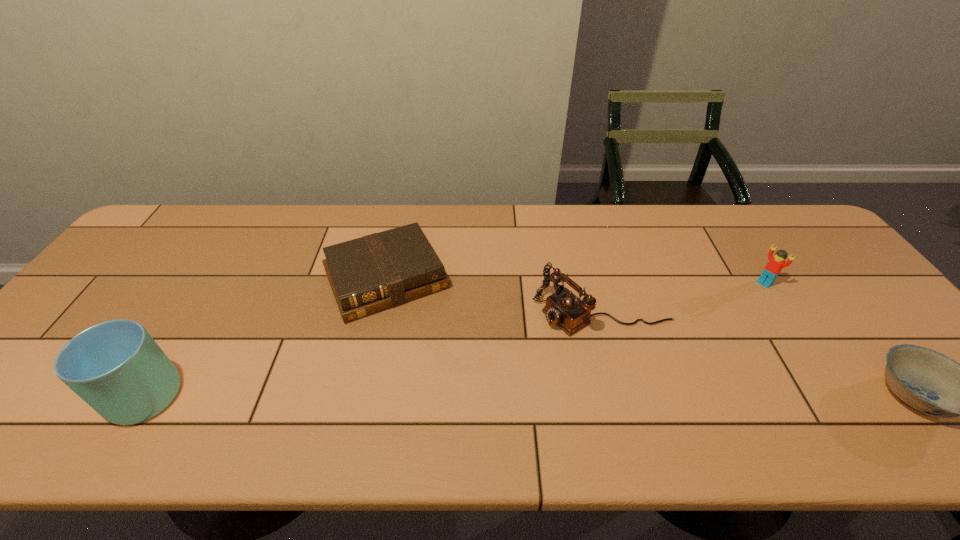
The width and height of the screenshot is (960, 540). Identify the location of free location at the right edge of the desktop. (818, 299).

In order to click on free space at the far left corner in this screenshot , I will do `click(184, 236)`.

You are a GUI agent. You are given a task and a screenshot of the screen. Output one action in this format:
    pyautogui.click(x=<x>, y=<y>)
    Task: Click on the unoccupied position between the Lego and the third object from left to right
    
    Given the screenshot: What is the action you would take?
    [683, 297]

This screenshot has width=960, height=540. I want to click on free space between the third object from left to right and the fourth object from left to right, so (683, 297).

Locate an element on the screen. unoccupied position between the third object from right to left and the tallest object is located at coordinates (369, 354).

The height and width of the screenshot is (540, 960). Identify the location of free space between the second object from left to right and the third object from right to left. (493, 295).

Locate an element on the screen. Image resolution: width=960 pixels, height=540 pixels. free space that is in between the tallest object and the second object from right to left is located at coordinates (450, 339).

The height and width of the screenshot is (540, 960). I want to click on free point between the tallest object and the second object from left to right, so click(x=261, y=338).

Locate an element on the screen. The image size is (960, 540). object that stands as the second closest to the second object from right to left is located at coordinates (570, 313).

Point out which object is positioned as the second nearest to the tallest object. Please provide its 2D coordinates. Your answer should be formatted as a tuple, i.e. [(x, y)], where the tuple contains the x and y coordinates of a point satisfying the conditions above.

[(570, 313)]